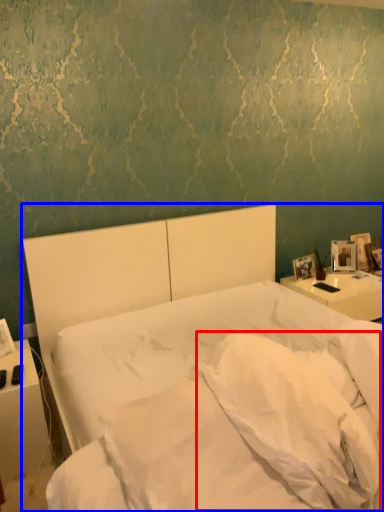
Question: Which point is further to the camera, pillow (highlighted by a red box) or bed (highlighted by a blue box)?

Choices:
 (A) pillow
 (B) bed

Answer: (A)